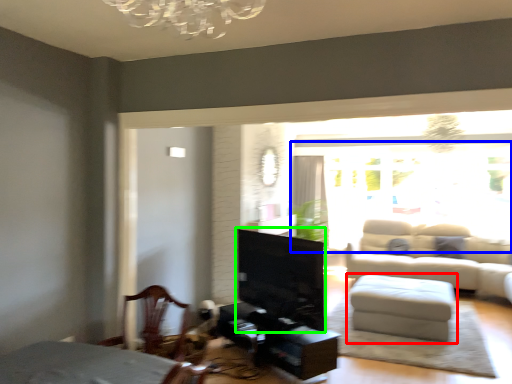
Question: Estimate the real-world distances between objects in this image. Which object is closer to table (highlighted by a red box), window screen (highlighted by a blue box) or fireplace (highlighted by a green box)?

Choices:
 (A) window screen
 (B) fireplace

Answer: (B)